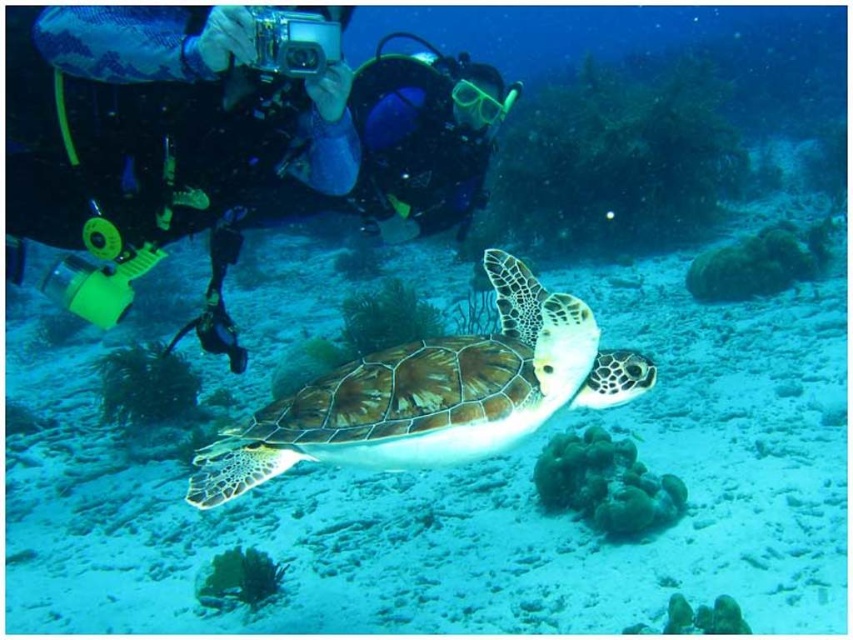
Question: Does green textured shell at center appear over blue rubber diving mask at center?

Choices:
 (A) yes
 (B) no

Answer: (B)

Question: Can you confirm if green textured shell at center is wider than blue rubber diving mask at center?

Choices:
 (A) no
 (B) yes

Answer: (B)

Question: Is green textured shell at center thinner than blue rubber diving mask at center?

Choices:
 (A) yes
 (B) no

Answer: (B)